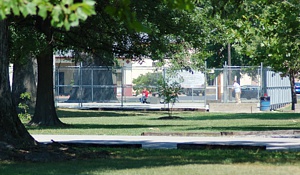
This screenshot has height=175, width=300. I want to click on trash can, so click(x=263, y=101).